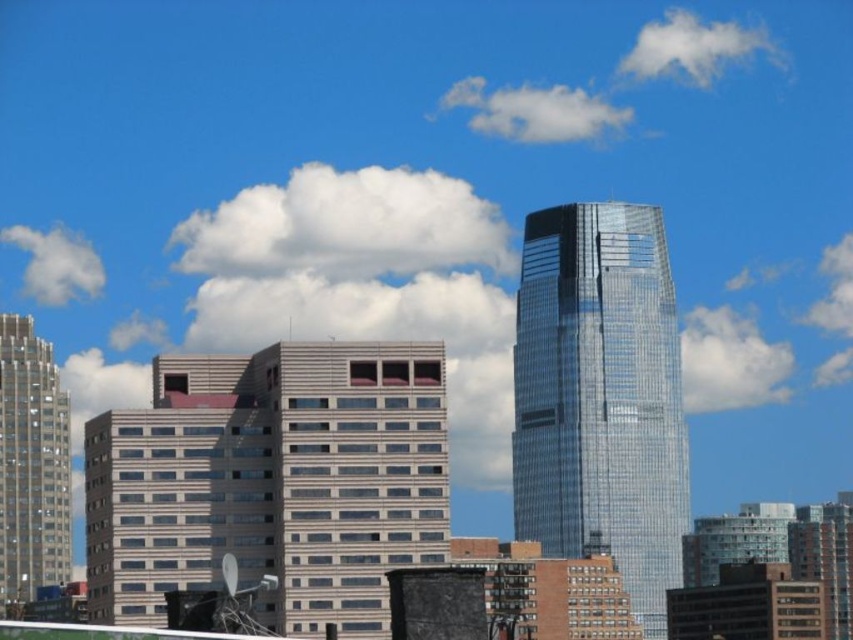
Question: Which point appears farthest from the camera in this image?

Choices:
 (A) (32, 456)
 (B) (289, 572)
 (C) (610, 216)

Answer: (C)

Question: Does beige glass building at center have a smaller size compared to matte glass skyscraper at left?

Choices:
 (A) yes
 (B) no

Answer: (A)

Question: Is beige glass building at center thinner than glassy reflective skyscraper at center?

Choices:
 (A) yes
 (B) no

Answer: (B)

Question: Among these points, which one is farthest from the camera?

Choices:
 (A) (178, 449)
 (B) (10, 568)

Answer: (B)

Question: Which object is positioned farthest from the matte glass skyscraper at left?

Choices:
 (A) glassy reflective skyscraper at center
 (B) beige glass building at center

Answer: (B)

Question: Where is beige glass building at center located in relation to glassy reflective skyscraper at center in the image?

Choices:
 (A) left
 (B) right

Answer: (A)